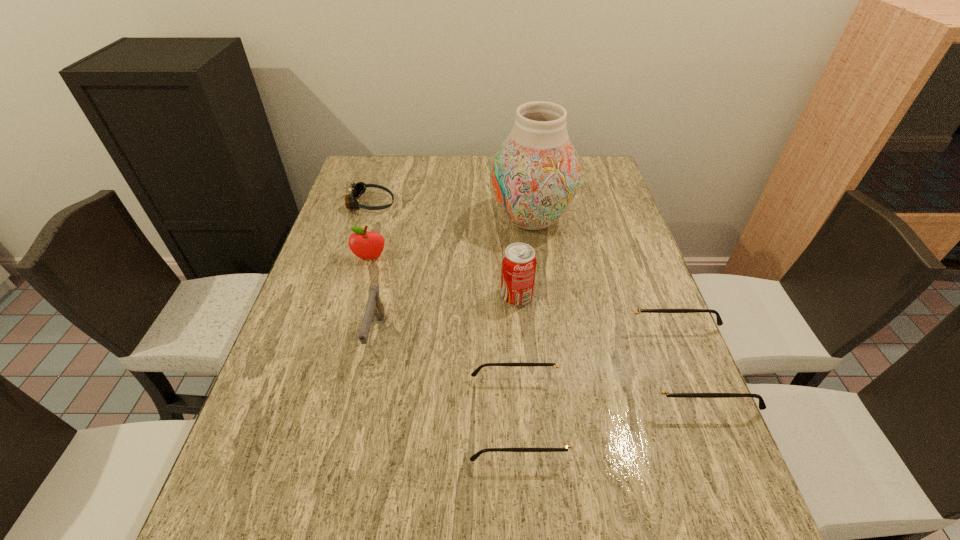
This screenshot has height=540, width=960. I want to click on vacant space located 0.070m at the hinge ends of the right spectacles, so (x=604, y=367).

Find the location of a particular element. This screenshot has width=960, height=540. vacant space located at the hinge ends of the right spectacles is located at coordinates (502, 367).

Identify the location of free space located at the hinge ends of the right spectacles. (512, 367).

I want to click on free point located on the front of the third farthest object, so click(x=360, y=298).

The height and width of the screenshot is (540, 960). What are the coordinates of `vacant space situated 0.130m on the right of the sixth shortest object` in the screenshot? It's located at (584, 296).

The image size is (960, 540). I want to click on vacant area located 0.300m through the lenses of the goggles, so click(x=489, y=204).

Locate an element on the screen. vacant area situated 0.050m on the right of the tallest object is located at coordinates (588, 219).

Locate an element on the screen. vacant space located 0.210m at the barrel of the third object from left to right is located at coordinates (349, 462).

You are a GUI agent. You are given a task and a screenshot of the screen. Output one action in this format:
    pyautogui.click(x=<x>, y=<y>)
    Task: Click on the object situated at the far edge
    Image resolution: width=960 pixels, height=540 pixels.
    Given the screenshot: What is the action you would take?
    pyautogui.click(x=356, y=190)

Find the location of a particular element. object that is positioned at the near edge is located at coordinates (559, 390).